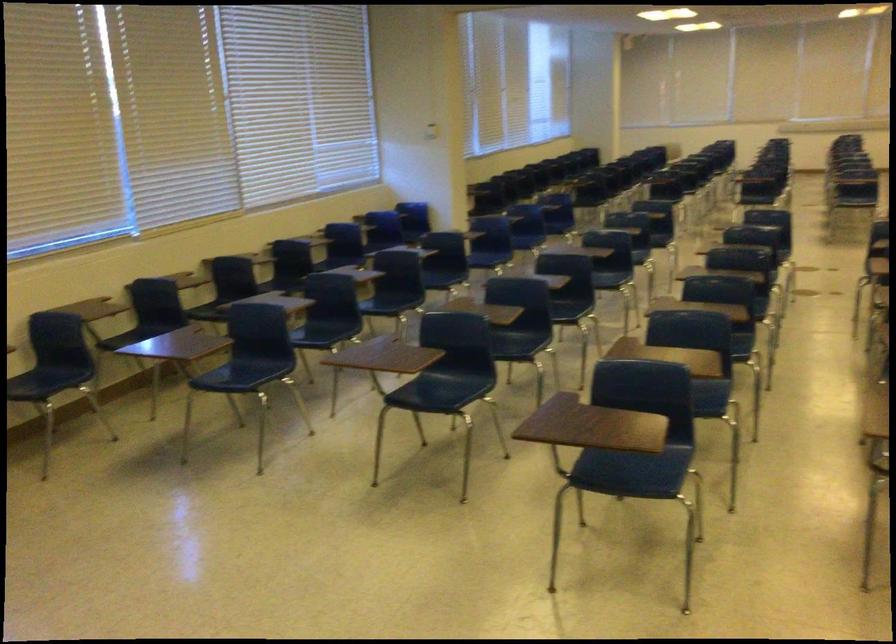
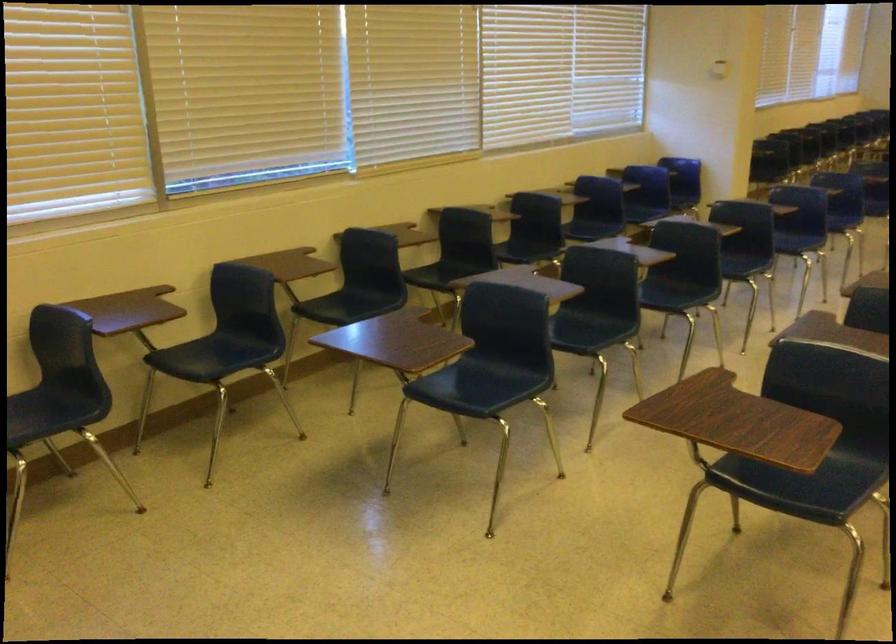
The point at (148, 336) is marked in the first image. Where is the corresponding point in the second image?

(359, 303)